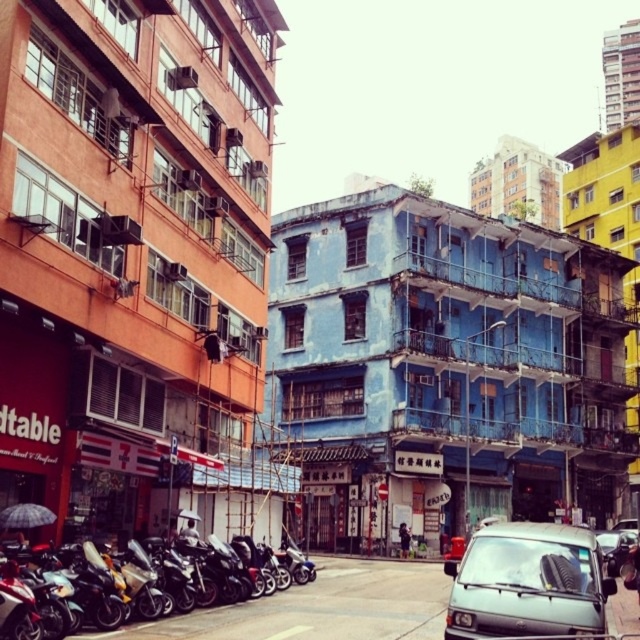
You are a delivery driver who needs to park your silver metallic van at lower right and metallic silver van at lower right in this street. According to the scene, which van should be parked first to ensure proper alignment with the existing parked vehicles?

The silver metallic van at lower right should be parked first since it is positioned to the left of the metallic silver van at lower right, aligning with the leftward parking direction of the existing motorcycles and scooters.

You are a delivery driver who needs to park your vehicle in this area. You have a silver metallic van at lower right and a metallic silver van at lower right. Which van is taller and therefore might require a higher clearance for parking? Please refer to the scene description for context.

The silver metallic van at lower right is taller than the metallic silver van at lower right, so it requires higher clearance for parking.